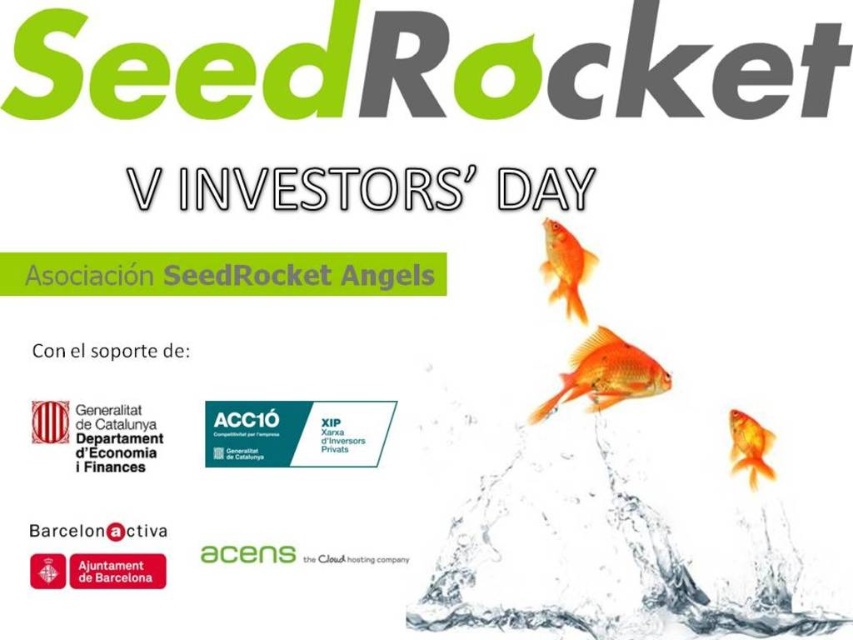
Question: Can you confirm if glossy orange fish at upper right is thinner than shiny orange fish at upper right?

Choices:
 (A) no
 (B) yes

Answer: (A)

Question: Which of these objects is positioned farthest from the shiny orange fish at upper right?

Choices:
 (A) transparent liquid water at center
 (B) glossy orange fish at upper right
 (C) orange matte goldfish at right

Answer: (A)

Question: Which object is farther from the camera taking this photo?

Choices:
 (A) orange matte goldfish at right
 (B) glossy orange fish at upper right
 (C) shiny orange fish at upper right
 (D) transparent liquid water at center

Answer: (C)

Question: Which object is the closest to the shiny orange fish at upper right?

Choices:
 (A) glossy orange fish at upper right
 (B) orange matte goldfish at right

Answer: (A)

Question: In this image, where is transparent liquid water at center located relative to glossy orange fish at upper right?

Choices:
 (A) left
 (B) right

Answer: (B)

Question: Is glossy orange fish at upper right bigger than orange matte goldfish at right?

Choices:
 (A) no
 (B) yes

Answer: (B)